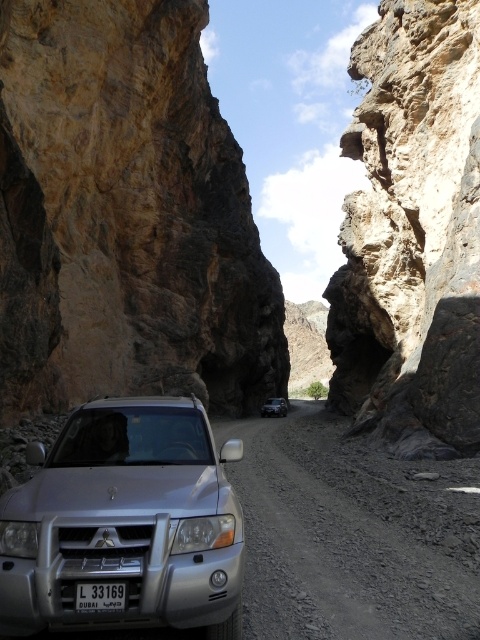
Which of these two, rustic stone arch at center or satin silver suv at center, stands shorter?

satin silver suv at center is shorter.

Which is in front, point (463, 269) or point (280, 412)?

Point (463, 269) is more forward.

Is point (405, 451) farther from camera compared to point (279, 401)?

No, (405, 451) is closer to viewer.

This screenshot has height=640, width=480. In order to click on rustic stone arch at center in this screenshot , I will do `click(412, 234)`.

Which of these two, rustic brown rock at center or rustic stone arch at center, stands shorter?

Standing shorter between the two is rustic stone arch at center.

Does rustic brown rock at center appear over rustic stone arch at center?

Yes.

This screenshot has width=480, height=640. Identify the location of rustic brown rock at center. (124, 216).

This screenshot has width=480, height=640. In order to click on rustic brown rock at center in this screenshot , I will do `click(124, 216)`.

Is point (464, 92) positioned after point (222, 465)?

Yes, it is.

Is rustic stone arch at center in front of silver metallic suv at center?

No, rustic stone arch at center is behind silver metallic suv at center.

Between point (402, 58) and point (111, 557), which one is positioned behind?

Positioned behind is point (402, 58).

At what (x,y) coordinates should I click in order to perform the action: click on rustic stone arch at center. Please return your answer as a coordinate pair (x, y). This screenshot has height=640, width=480. Looking at the image, I should click on tap(412, 234).